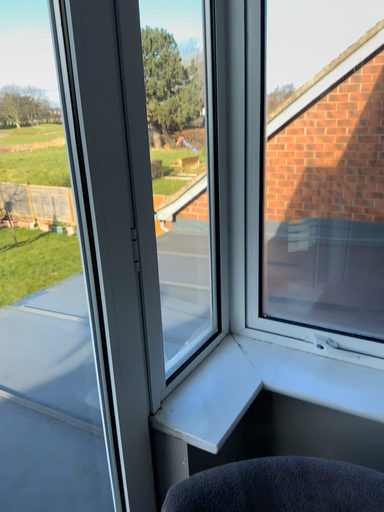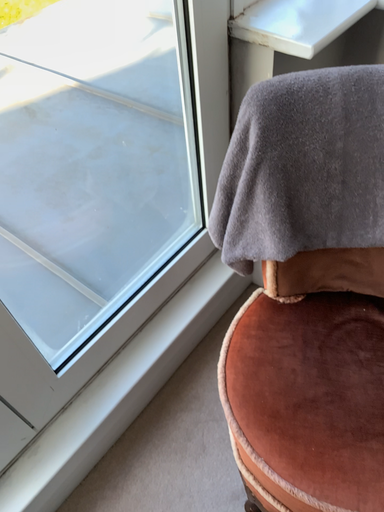
Question: How did the camera likely rotate when shooting the video?

Choices:
 (A) rotated right
 (B) rotated left

Answer: (B)